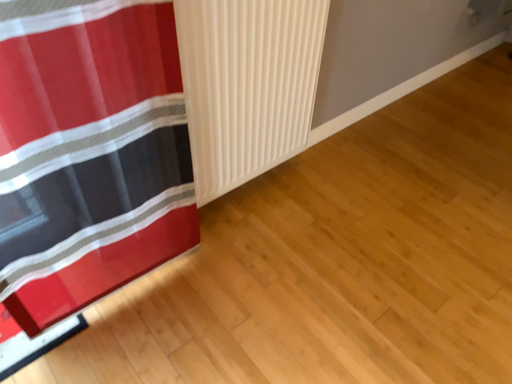
Question: Should I look upward or downward to see white ribbed curtain at center?

Choices:
 (A) down
 (B) up

Answer: (B)